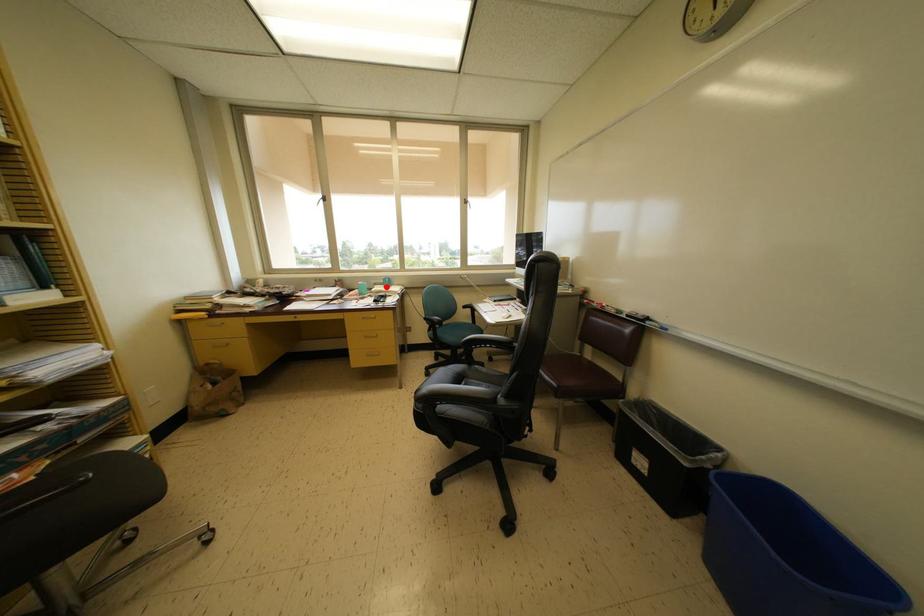
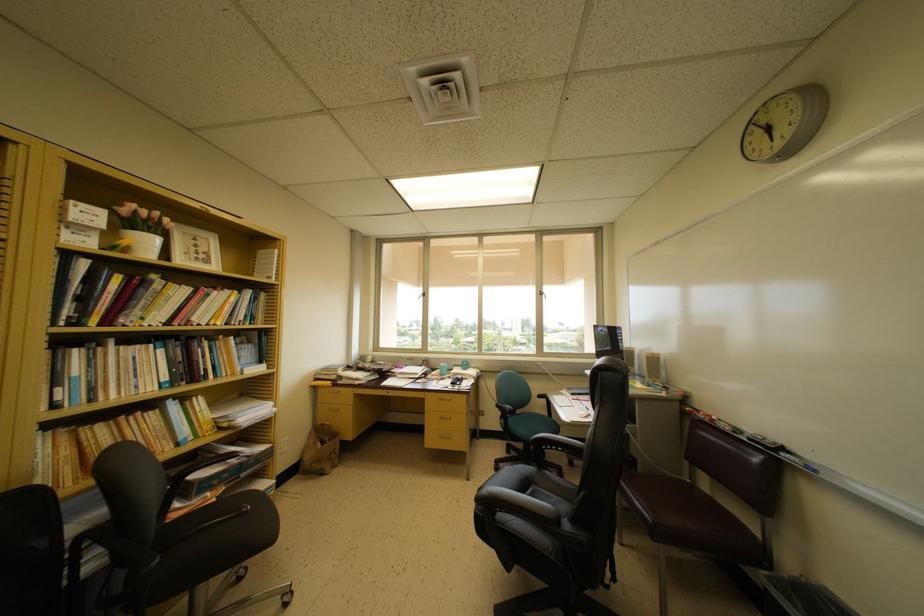
Where in the second image is the point corresponding to the highlighted location from the first image?

(465, 369)